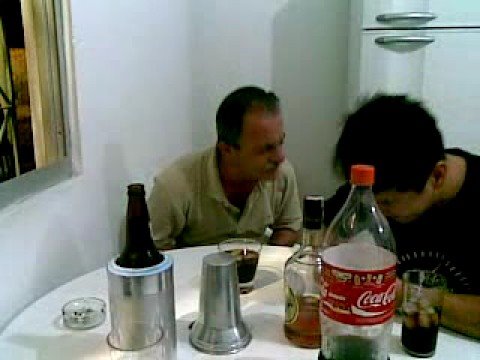
The height and width of the screenshot is (360, 480). Identify the location of ashtray. (90, 319).